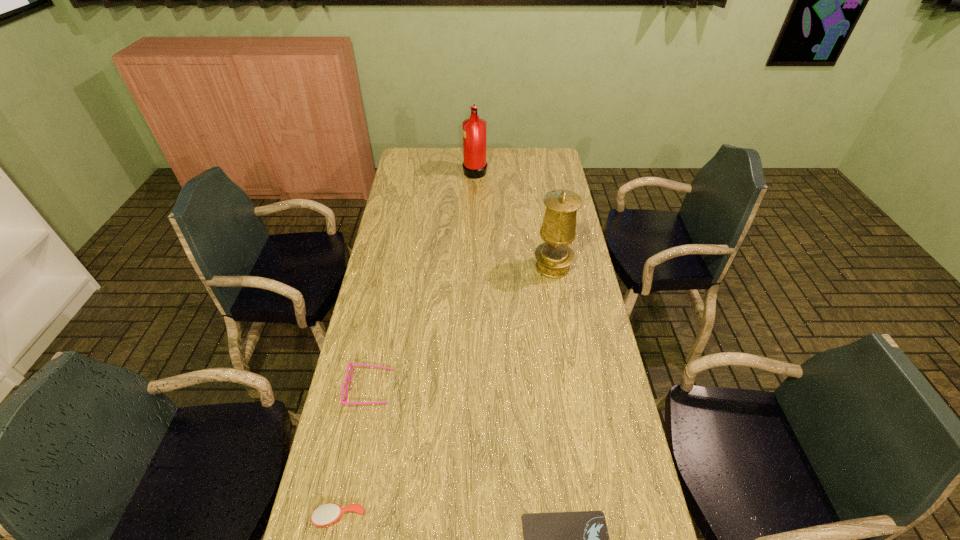
This screenshot has width=960, height=540. Find the location of `object located in the far edge section of the desktop`. object located in the far edge section of the desktop is located at coordinates (474, 128).

Where is `spectacles that is at the left edge`? spectacles that is at the left edge is located at coordinates (350, 364).

Locate an element on the screen. The width and height of the screenshot is (960, 540). hairbrush that is at the left edge is located at coordinates (327, 514).

At what (x,y) coordinates should I click in order to perform the action: click on object at the right edge. Please return your answer as a coordinate pair (x, y). The width and height of the screenshot is (960, 540). Looking at the image, I should click on point(554,256).

In the image, there is a desktop. Identify the location of vacant space at the left edge. The width and height of the screenshot is (960, 540). (396, 199).

Locate an element on the screen. Image resolution: width=960 pixels, height=540 pixels. vacant space at the far right corner is located at coordinates (546, 168).

Where is `vacant space that's between the fire extinguisher and the oil lamp`? vacant space that's between the fire extinguisher and the oil lamp is located at coordinates (514, 219).

The height and width of the screenshot is (540, 960). What are the coordinates of `free space between the third tallest object and the fourth nearest object` in the screenshot? It's located at (462, 327).

Locate an element on the screen. free space between the second farthest object and the farthest object is located at coordinates (514, 219).

Where is `free spot between the fourth nearest object and the farthest object`? The image size is (960, 540). free spot between the fourth nearest object and the farthest object is located at coordinates (514, 219).